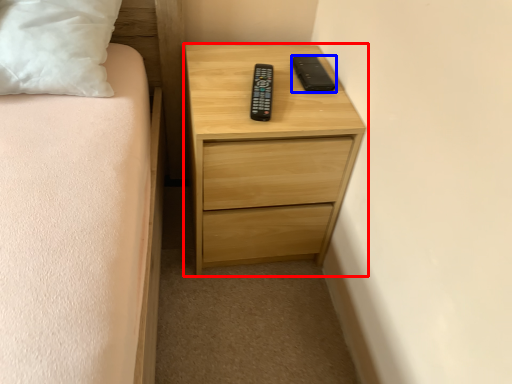
Question: Which object is closer to the camera taking this photo, chest of drawers (highlighted by a red box) or gadget (highlighted by a blue box)?

Choices:
 (A) chest of drawers
 (B) gadget

Answer: (A)